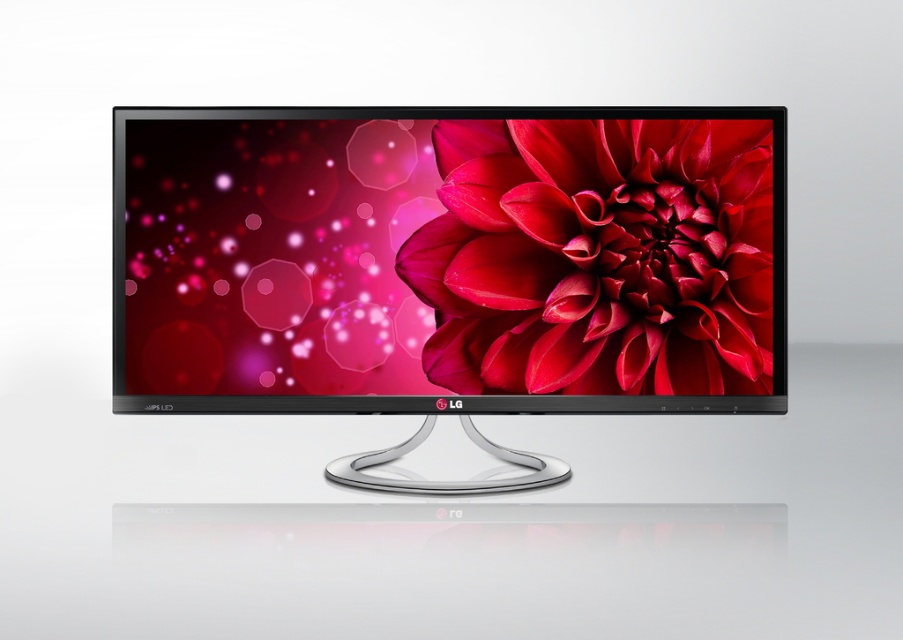
You are setting up a new monitor and want to ensure proper visibility. Given that the satin black monitor at center is in front of the matte red flower at center, will the red flower be visible through the monitor?

The satin black monitor at center is in front of the matte red flower at center, so the red flower will not be visible through the monitor.

You are standing 5 feet away from the point at point [555,188]. Can you walk towards it and get within 2 feet?

The distance between you and the point at point [555,188] is 3.40 feet. Since you want to get within 2 feet, you can move closer by 1.40 feet to achieve that distance.